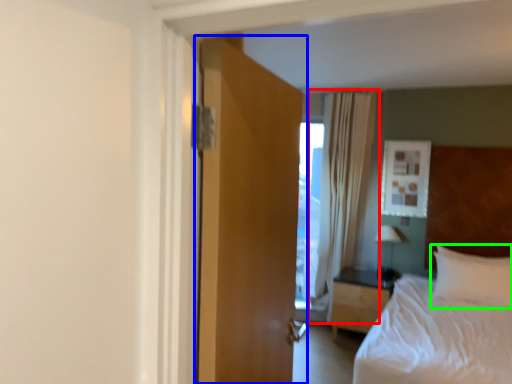
Question: Which object is positioned closest to curtain (highlighted by a red box)? Select from door (highlighted by a blue box) and pillow (highlighted by a green box).

Choices:
 (A) door
 (B) pillow

Answer: (B)